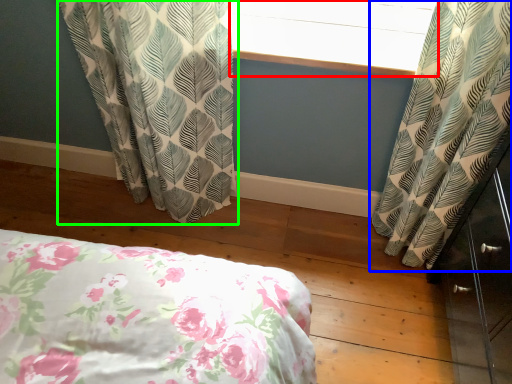
Question: Which object is the farthest from window screen (highlighted by a red box)? Choose among these: curtain (highlighted by a blue box) or curtain (highlighted by a green box).

Choices:
 (A) curtain
 (B) curtain

Answer: (B)